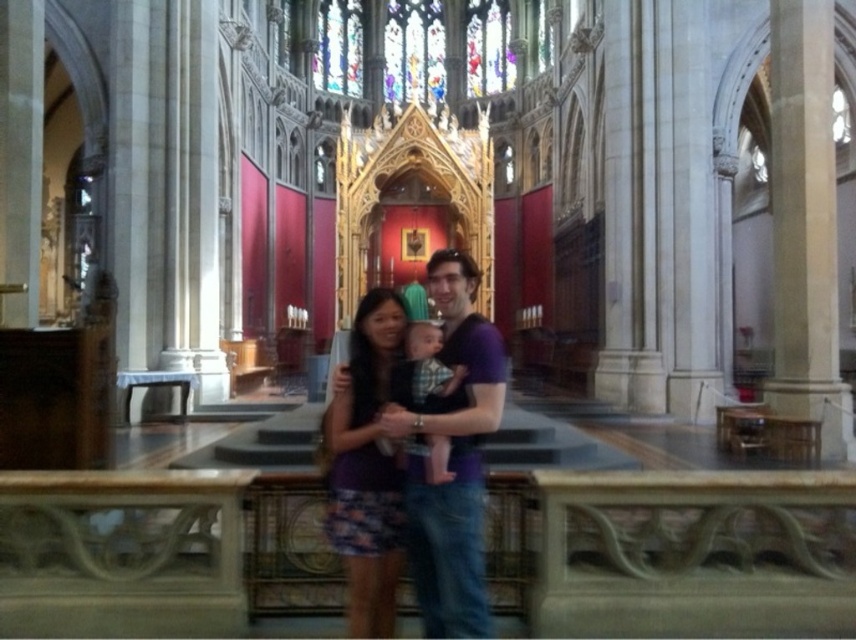
Does purple cotton shirt at center have a lesser height compared to purple fabric dress at center?

Answer: In fact, purple cotton shirt at center may be taller than purple fabric dress at center.

Does point (441, 292) come farther from viewer compared to point (351, 326)?

No, it is not.

Image resolution: width=856 pixels, height=640 pixels. Find the location of `purple cotton shirt at center`. purple cotton shirt at center is located at coordinates (452, 456).